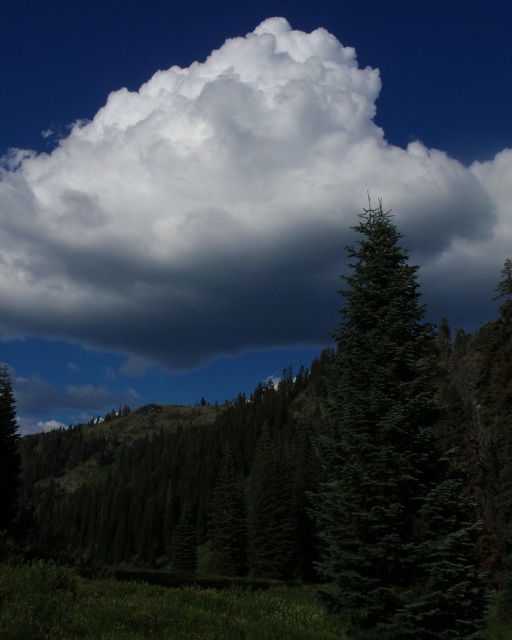
Is white fluffy cloud at upper center wider than green matte tree at center?

Correct, the width of white fluffy cloud at upper center exceeds that of green matte tree at center.

Can you confirm if white fluffy cloud at upper center is positioned below green matte tree at center?

No.

Between point (192, 141) and point (421, 541), which one is positioned behind?

Positioned behind is point (192, 141).

I want to click on white fluffy cloud at upper center, so click(234, 208).

Find the location of a particular element. green matte tree at center is located at coordinates (392, 464).

Is green matte tree at center positioned at the back of green matte tree at left?

No, it is not.

Which is in front, point (385, 516) or point (6, 371)?

Point (385, 516)

The width and height of the screenshot is (512, 640). What are the coordinates of `green matte tree at center` in the screenshot? It's located at (392, 464).

Who is higher up, white fluffy cloud at upper center or green matte tree at left?

white fluffy cloud at upper center is higher up.

Is white fluffy cloud at upper center to the left of green matte tree at left from the viewer's perspective?

Incorrect, white fluffy cloud at upper center is not on the left side of green matte tree at left.

Which is behind, point (285, 196) or point (9, 476)?

The point (285, 196) is more distant.

This screenshot has width=512, height=640. Find the location of `white fluffy cloud at upper center`. white fluffy cloud at upper center is located at coordinates (234, 208).